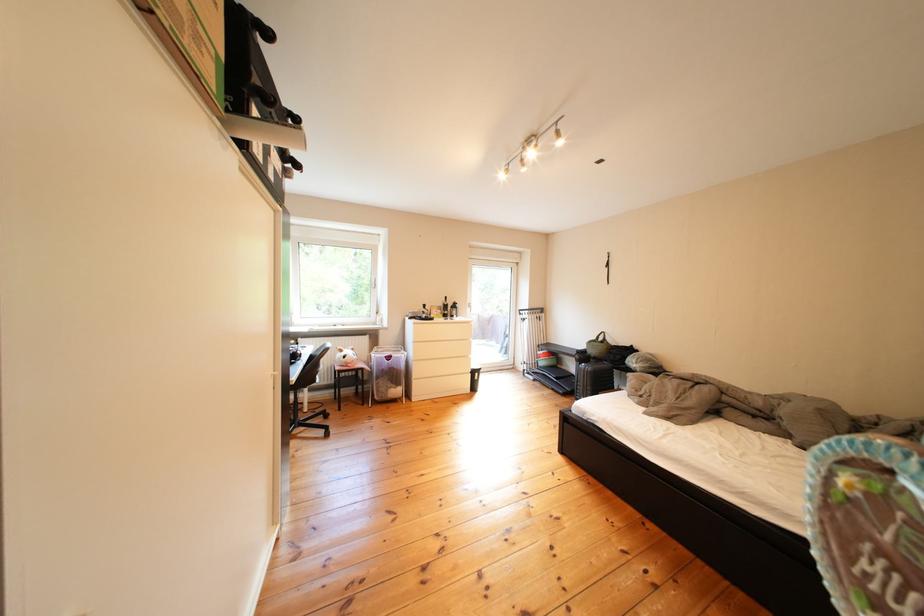
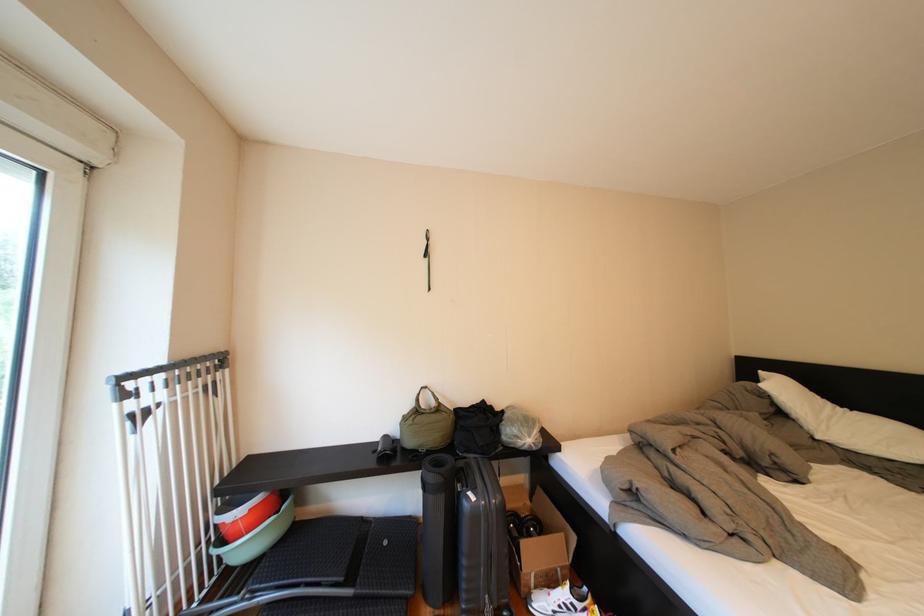
Find the pixel in the second image that matches point (555, 368) in the first image.

(261, 551)